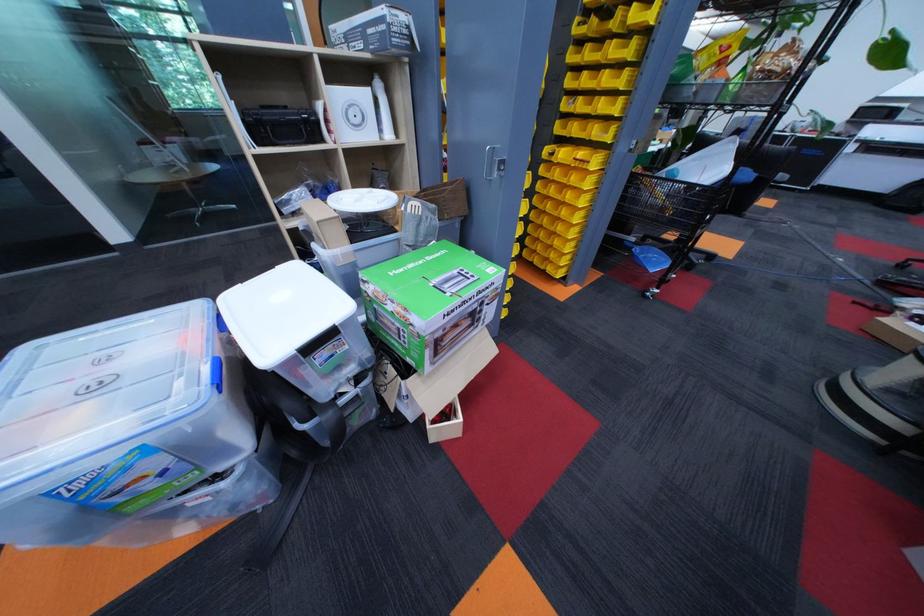
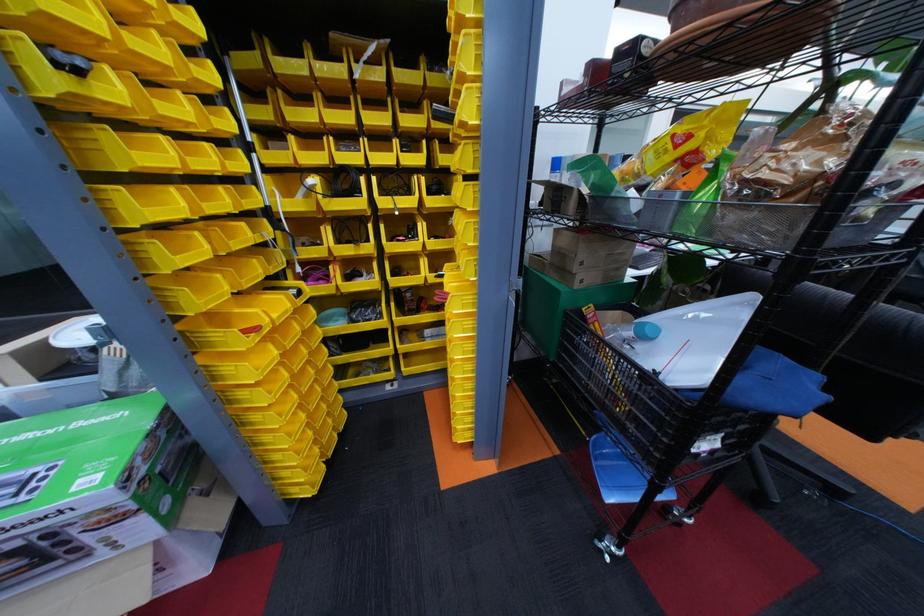
In the second image, find the point that corresponds to point (743, 49) in the first image.

(702, 138)